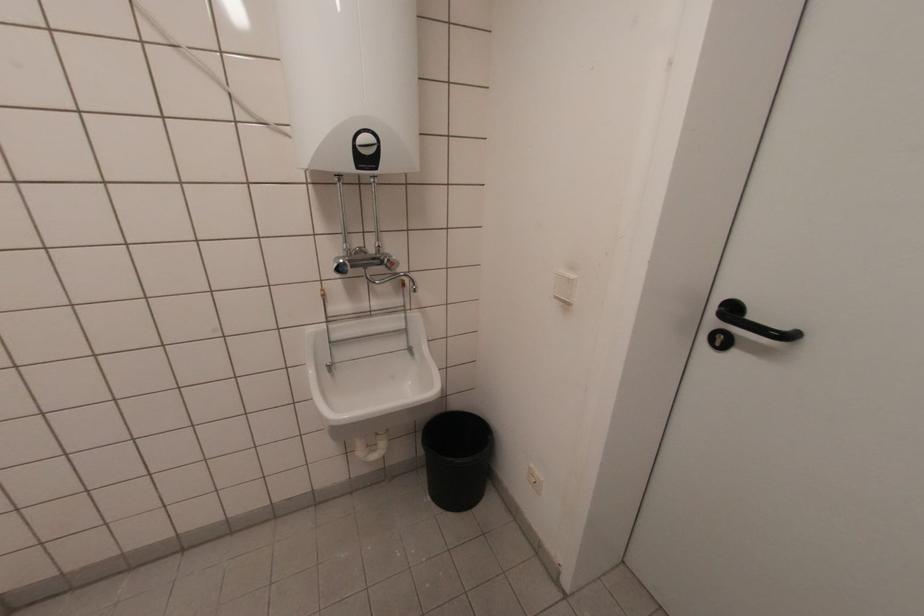
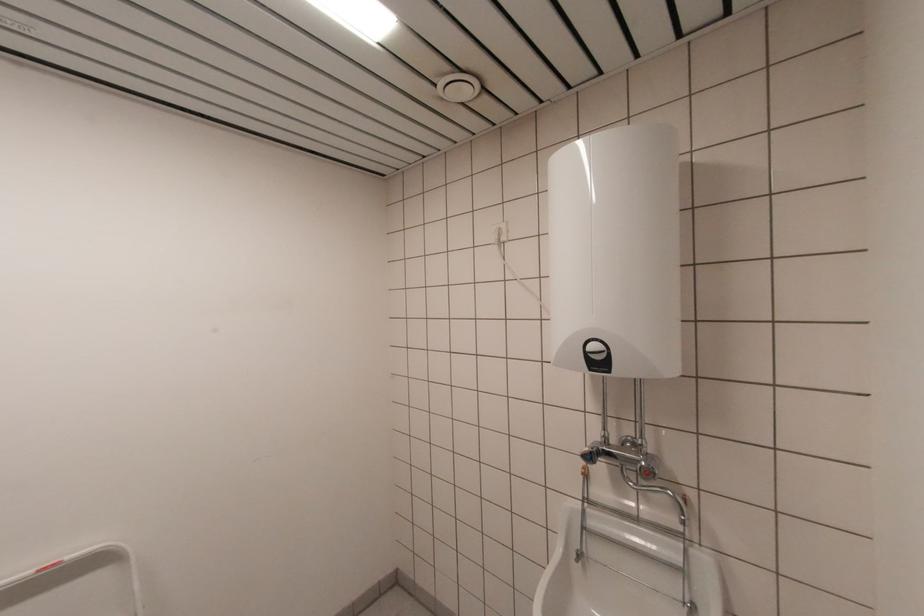
Find the pixel in the second image that matches point 377,148 in the first image.

(605, 354)